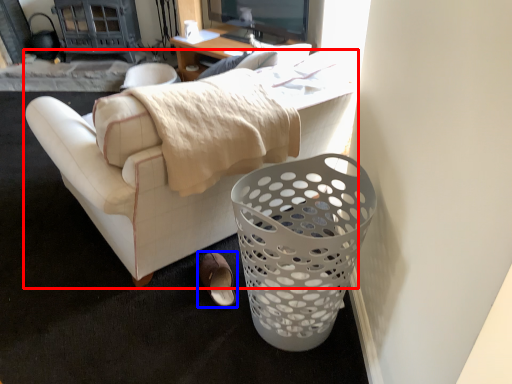
Question: Which object is further to the camera taking this photo, studio couch (highlighted by a red box) or footwear (highlighted by a blue box)?

Choices:
 (A) studio couch
 (B) footwear

Answer: (B)